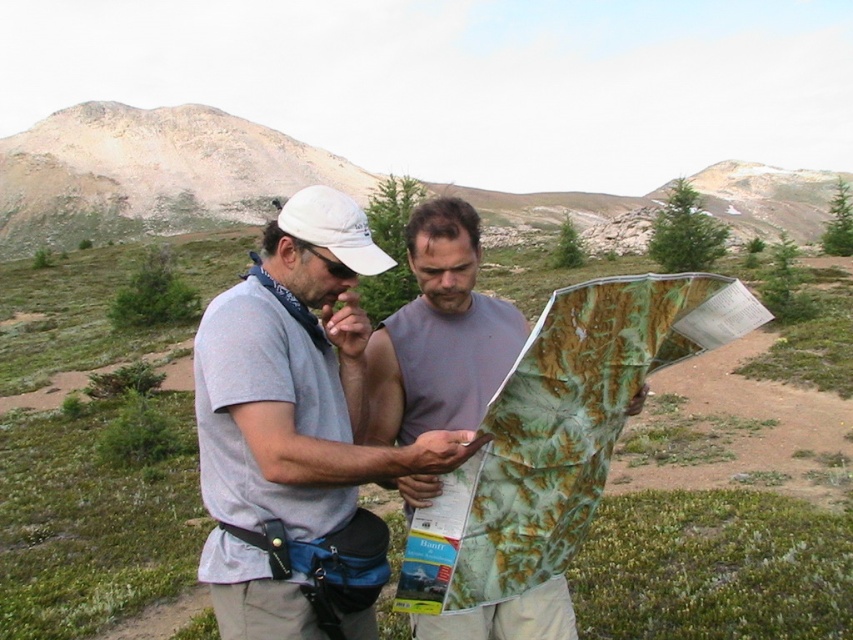
You are a hiker who needs to locate the green textured map at center in the image. According to the coordinates provided, where would you find it?

The green textured map at center is located at the coordinates point (558,433).

You are a hiker who needs to check the map to navigate a trail. You see the green textured map at center and the matte gray shirt at center. Which object is smaller and needs careful handling to avoid losing it?

The green textured map at center is smaller than the matte gray shirt at center, so it needs careful handling to avoid losing it.

Based on the photo, you are a hiker trying to determine which object in the scene is smaller between the matte gray shirt at center and the rugged brown mountain at upper center. Based on the spatial relationships in the image, which one is smaller?

The matte gray shirt at center is smaller than the rugged brown mountain at upper center according to the description.